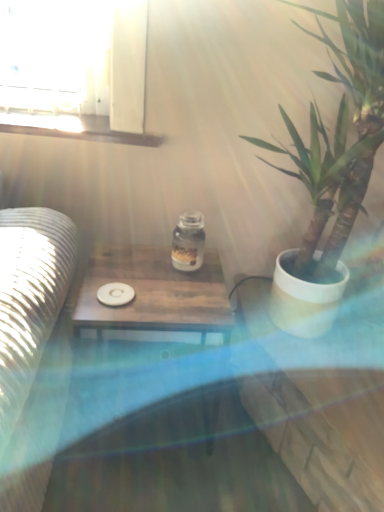
You are a GUI agent. You are given a task and a screenshot of the screen. Output one action in this format:
    pyautogui.click(x=<x>, y=<y>)
    Task: Click on the free location in front of white matte coaster at center
    The height and width of the screenshot is (512, 384).
    Given the screenshot: What is the action you would take?
    pyautogui.click(x=104, y=314)